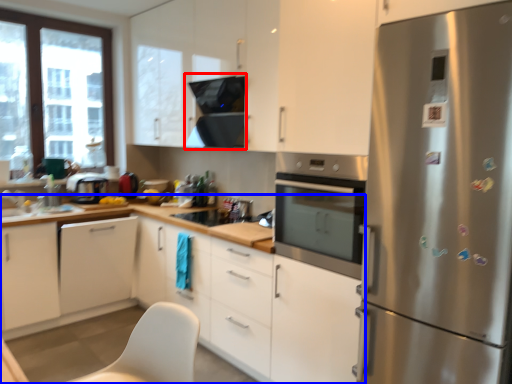
Question: Among these objects, which one is farthest to the camera, exhaust hood (highlighted by a red box) or cabinetry (highlighted by a blue box)?

Choices:
 (A) exhaust hood
 (B) cabinetry

Answer: (A)